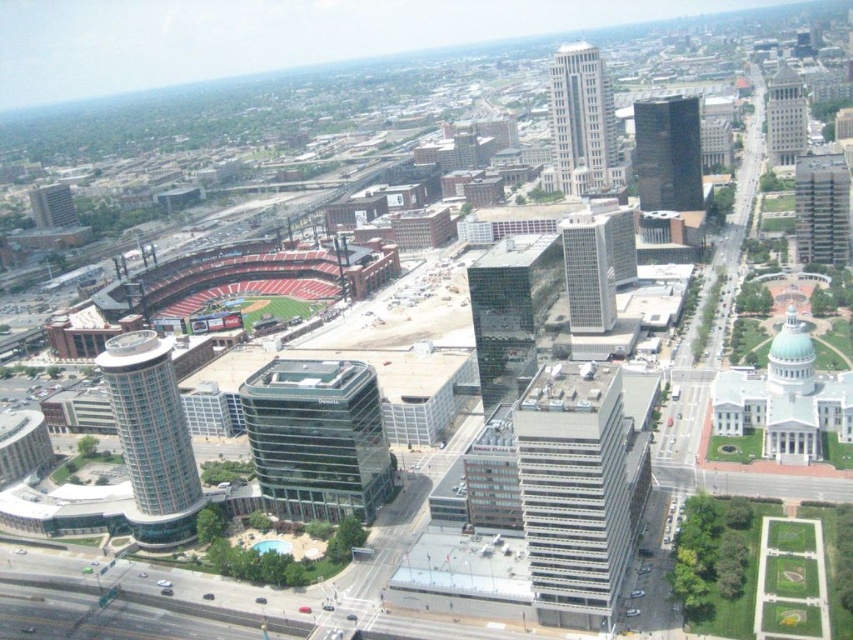
Can you confirm if glassy silver tower at center-left is wider than white glass skyscraper at upper center?

Incorrect, glassy silver tower at center-left's width does not surpass white glass skyscraper at upper center's.

Does glassy silver tower at center-left have a smaller size compared to white glass skyscraper at upper center?

Indeed, glassy silver tower at center-left has a smaller size compared to white glass skyscraper at upper center.

Is point (173, 420) farther from camera compared to point (598, 157)?

No.

Find the location of a particular element. Image resolution: width=853 pixels, height=640 pixels. glassy silver tower at center-left is located at coordinates (152, 436).

From the picture: Between glassy gray skyscraper at upper right and gray glass skyscraper at upper right, which one has less height?

With less height is glassy gray skyscraper at upper right.

Who is positioned more to the right, glassy gray skyscraper at upper right or gray glass skyscraper at upper right?

gray glass skyscraper at upper right is more to the right.

Between point (816, 156) and point (782, 148), which one is positioned behind?

The point (782, 148) is behind.

Image resolution: width=853 pixels, height=640 pixels. I want to click on glassy gray skyscraper at upper right, so click(821, 209).

Is white glass skyscraper at upper center taller than gray glass skyscraper at center?

Yes, white glass skyscraper at upper center is taller than gray glass skyscraper at center.

Between white glass skyscraper at upper center and gray glass skyscraper at center, which one has less height?

gray glass skyscraper at center

Is point (590, 84) farther from viewer compared to point (624, 236)?

Yes, it is behind point (624, 236).

Where is `white glass skyscraper at upper center`? The height and width of the screenshot is (640, 853). white glass skyscraper at upper center is located at coordinates (581, 120).